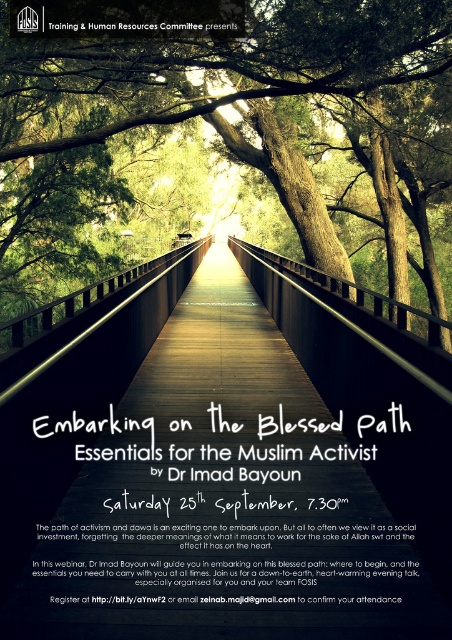
You are standing at the starting point of the wooden bridge at center. Based on the coordinates provided, how far along the bridge is the point at (x=224, y=477) located?

The wooden bridge at center is represented by point (x=224, y=477), so the point is exactly at the center of the bridge.

You are planning to cross the wooden bridge at center and the green wood bridge at center. Based on their heights, which bridge might be more stable to walk on?

The green wood bridge at center has a greater height than the wooden bridge at center, so it might be more stable to walk on.